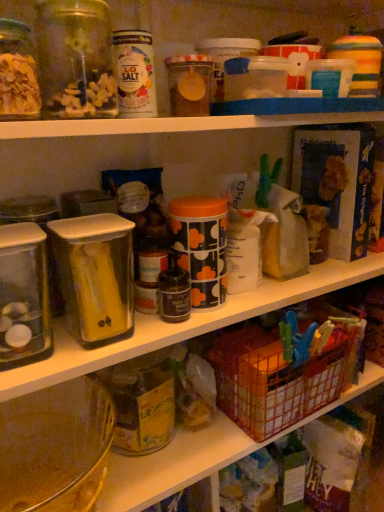
Describe the element at coordinates (276, 378) in the screenshot. I see `metallic wire basket at lower right` at that location.

What do you see at coordinates (75, 59) in the screenshot?
I see `clear glass jar at upper left, the 2th glass jar viewed from the back` at bounding box center [75, 59].

Identify the location of translucent glass jar at lower center, which is the 1th glass jar from bottom to top. (142, 402).

The width and height of the screenshot is (384, 512). Identify the location of metallic wire basket at lower right. (276, 378).

Is clear glass jar at upper left, which is counted as the 1th glass jar, starting from the front, placed right next to metallic wire basket at lower right?

No, clear glass jar at upper left, which is counted as the 1th glass jar, starting from the front, is not touching metallic wire basket at lower right.

Is clear glass jar at upper left, which appears as the first glass jar when viewed from the top, to the left of metallic wire basket at lower right from the viewer's perspective?

Correct, you'll find clear glass jar at upper left, which appears as the first glass jar when viewed from the top, to the left of metallic wire basket at lower right.

Is clear glass jar at upper left, which appears as the first glass jar when viewed from the top, positioned before metallic wire basket at lower right?

Yes.

Considering the sizes of clear glass jar at upper left, marked as the second glass jar in a bottom-to-top arrangement, and metallic wire basket at lower right in the image, is clear glass jar at upper left, marked as the second glass jar in a bottom-to-top arrangement, bigger or smaller than metallic wire basket at lower right?

clear glass jar at upper left, marked as the second glass jar in a bottom-to-top arrangement, is smaller than metallic wire basket at lower right.

Does metallic wire basket at lower right lie behind clear plastic canister at center-left?

Yes, the depth of metallic wire basket at lower right is greater than that of clear plastic canister at center-left.

What are the coordinates of `carton to the left of metallic wire basket at lower right` in the screenshot? It's located at (95, 276).

Is point (336, 318) farther from viewer compared to point (81, 237)?

Yes, it is.

Could you measure the distance between metallic wire basket at lower right and clear glass jar at upper left, marked as the second glass jar in a bottom-to-top arrangement?

metallic wire basket at lower right and clear glass jar at upper left, marked as the second glass jar in a bottom-to-top arrangement, are 24.83 inches apart from each other.

From the image's perspective, is metallic wire basket at lower right under clear glass jar at upper left, which appears as the first glass jar when viewed from the top?

Yes, from the image's perspective, metallic wire basket at lower right is below clear glass jar at upper left, which appears as the first glass jar when viewed from the top.

From a real-world perspective, does metallic wire basket at lower right sit lower than clear glass jar at upper left, which is counted as the 1th glass jar, starting from the front?

Indeed, from a real-world perspective, metallic wire basket at lower right is positioned beneath clear glass jar at upper left, which is counted as the 1th glass jar, starting from the front.

Is metallic wire basket at lower right oriented towards clear glass jar at upper left, the 2th glass jar viewed from the back?

No, metallic wire basket at lower right is not aimed at clear glass jar at upper left, the 2th glass jar viewed from the back.

At what (x,y) coordinates should I click in order to perform the action: click on glass jar that appears on the right of clear glass jar at upper left, marked as the second glass jar in a bottom-to-top arrangement. Please return your answer as a coordinate pair (x, y). Looking at the image, I should click on (142, 402).

Which is nearer, (122, 434) or (102, 81)?

Point (122, 434) is positioned farther from the camera compared to point (102, 81).

Who is shorter, translucent glass jar at lower center, the second glass jar from the top, or clear glass jar at upper left, marked as the second glass jar in a bottom-to-top arrangement?

clear glass jar at upper left, marked as the second glass jar in a bottom-to-top arrangement.

From a real-world perspective, does translucent glass jar at lower center, which is counted as the second glass jar, starting from the front, stand above clear glass jar at upper left, marked as the second glass jar in a bottom-to-top arrangement?

No, from a real-world perspective, translucent glass jar at lower center, which is counted as the second glass jar, starting from the front, is not on top of clear glass jar at upper left, marked as the second glass jar in a bottom-to-top arrangement.

Does clear plastic canister at center-left have a lesser width compared to clear glass jar at upper left, the 2th glass jar viewed from the back?

In fact, clear plastic canister at center-left might be wider than clear glass jar at upper left, the 2th glass jar viewed from the back.

From the image's perspective, which is above, clear plastic canister at center-left or clear glass jar at upper left, which is counted as the 1th glass jar, starting from the front?

From the image's view, clear glass jar at upper left, which is counted as the 1th glass jar, starting from the front, is above.

This screenshot has height=512, width=384. Find the location of `carton below the clear glass jar at upper left, which is counted as the 1th glass jar, starting from the front (from the image's perspective)`. carton below the clear glass jar at upper left, which is counted as the 1th glass jar, starting from the front (from the image's perspective) is located at coordinates (95, 276).

Between clear plastic canister at center-left and clear glass jar at upper left, marked as the second glass jar in a bottom-to-top arrangement, which one has larger size?

clear plastic canister at center-left.

Is translucent glass jar at lower center, which is the first glass jar from back to front, beside metallic wire basket at lower right?

No, translucent glass jar at lower center, which is the first glass jar from back to front, is not in contact with metallic wire basket at lower right.

From a real-world perspective, is translucent glass jar at lower center, which is the 1th glass jar from bottom to top, on top of metallic wire basket at lower right?

Yes, from a real-world perspective, translucent glass jar at lower center, which is the 1th glass jar from bottom to top, is on top of metallic wire basket at lower right.

Is translucent glass jar at lower center, the second glass jar from the top, outside of metallic wire basket at lower right?

Yes, translucent glass jar at lower center, the second glass jar from the top, is not within metallic wire basket at lower right.

Which object is wider, translucent glass jar at lower center, which is the first glass jar from back to front, or metallic wire basket at lower right?

With larger width is metallic wire basket at lower right.

From the image's perspective, relative to clear plastic canister at center-left, is translucent glass jar at lower center, which is counted as the second glass jar, starting from the front, above or below?

Based on their image positions, translucent glass jar at lower center, which is counted as the second glass jar, starting from the front, is located beneath clear plastic canister at center-left.

From a real-world perspective, who is located higher, translucent glass jar at lower center, the second glass jar from the top, or clear plastic canister at center-left?

From a 3D spatial view, clear plastic canister at center-left is above.

Considering the sizes of objects translucent glass jar at lower center, which is counted as the second glass jar, starting from the front, and clear plastic canister at center-left in the image provided, who is wider, translucent glass jar at lower center, which is counted as the second glass jar, starting from the front, or clear plastic canister at center-left?

Wider between the two is translucent glass jar at lower center, which is counted as the second glass jar, starting from the front.

Does translucent glass jar at lower center, which is the 1th glass jar from bottom to top, appear on the left side of clear plastic canister at center-left?

No.

This screenshot has width=384, height=512. I want to click on glass jar that is the 2nd one above the metallic wire basket at lower right (from a real-world perspective), so click(x=75, y=59).

This screenshot has width=384, height=512. Identify the location of basket on the right of clear plastic canister at center-left. (276, 378).

Based on their spatial positions, is metallic wire basket at lower right or clear glass jar at upper left, which is counted as the 1th glass jar, starting from the front, closer to clear plastic canister at center-left?

Based on the image, clear glass jar at upper left, which is counted as the 1th glass jar, starting from the front, appears to be nearer to clear plastic canister at center-left.

Which object lies nearer to the anchor point clear plastic canister at center-left, translucent glass jar at lower center, which is counted as the second glass jar, starting from the front, or clear glass jar at upper left, which appears as the first glass jar when viewed from the top?

Among the two, translucent glass jar at lower center, which is counted as the second glass jar, starting from the front, is located nearer to clear plastic canister at center-left.

When comparing their distances from translucent glass jar at lower center, which is the first glass jar from back to front, does clear glass jar at upper left, which is counted as the 1th glass jar, starting from the front, or metallic wire basket at lower right seem closer?

Among the two, metallic wire basket at lower right is located nearer to translucent glass jar at lower center, which is the first glass jar from back to front.

When comparing their distances from translucent glass jar at lower center, which is the first glass jar from back to front, does metallic wire basket at lower right or clear glass jar at upper left, which appears as the first glass jar when viewed from the top, seem closer?

The object closer to translucent glass jar at lower center, which is the first glass jar from back to front, is metallic wire basket at lower right.

Considering their positions, is metallic wire basket at lower right positioned closer to clear plastic canister at center-left than translucent glass jar at lower center, which is counted as the second glass jar, starting from the front?

translucent glass jar at lower center, which is counted as the second glass jar, starting from the front.

Which object lies nearer to the anchor point clear plastic canister at center-left, clear glass jar at upper left, the 2th glass jar viewed from the back, or metallic wire basket at lower right?

The object closer to clear plastic canister at center-left is clear glass jar at upper left, the 2th glass jar viewed from the back.

Considering their positions, is clear plastic canister at center-left positioned closer to translucent glass jar at lower center, which is counted as the second glass jar, starting from the front, than clear glass jar at upper left, the 2th glass jar viewed from the back?

Among the two, clear plastic canister at center-left is located nearer to translucent glass jar at lower center, which is counted as the second glass jar, starting from the front.

In the scene shown: Which object lies nearer to the anchor point clear glass jar at upper left, marked as the second glass jar in a bottom-to-top arrangement, metallic wire basket at lower right or clear plastic canister at center-left?

clear plastic canister at center-left is positioned closer to the anchor clear glass jar at upper left, marked as the second glass jar in a bottom-to-top arrangement.

The width and height of the screenshot is (384, 512). I want to click on basket between clear glass jar at upper left, marked as the second glass jar in a bottom-to-top arrangement, and translucent glass jar at lower center, the second glass jar from the top, from top to bottom, so click(276, 378).

You are a GUI agent. You are given a task and a screenshot of the screen. Output one action in this format:
    pyautogui.click(x=<x>, y=<y>)
    Task: Click on the carton between clear glass jar at upper left, marked as the second glass jar in a bottom-to-top arrangement, and metallic wire basket at lower right in the up-down direction
    This screenshot has width=384, height=512.
    Given the screenshot: What is the action you would take?
    pyautogui.click(x=95, y=276)

Identify the location of glass jar between clear plastic canister at center-left and metallic wire basket at lower right. tap(142, 402).

At what (x,y) coordinates should I click in order to perform the action: click on carton that lies between clear glass jar at upper left, which is counted as the 1th glass jar, starting from the front, and translucent glass jar at lower center, which is the first glass jar from back to front, from top to bottom. Please return your answer as a coordinate pair (x, y). The width and height of the screenshot is (384, 512). Looking at the image, I should click on (95, 276).